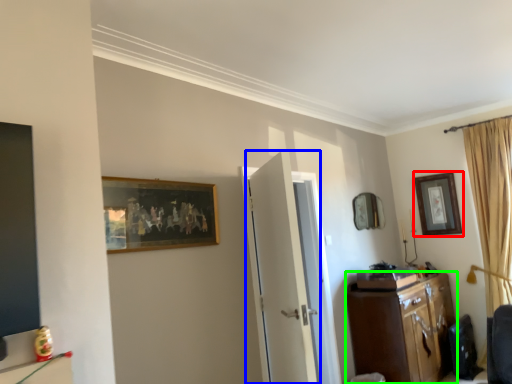
Question: Based on their relative distances, which object is nearer to picture frame (highlighted by a red box)? Choose from door (highlighted by a blue box) and cabinetry (highlighted by a green box).

Choices:
 (A) door
 (B) cabinetry

Answer: (B)